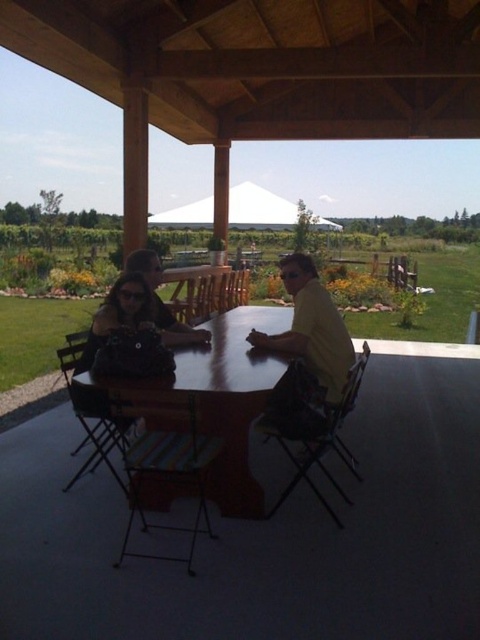
You are a photographer standing outside the wooden pavilion. You want to take a photo of the yellow matte shirt at center and the white fabric canopy at upper center so that both are clearly visible. Considering their heights, which object should be placed closer to the camera to ensure both are fully visible in the frame?

The yellow matte shirt at center has a lesser height compared to the white fabric canopy at upper center. To ensure both are fully visible in the frame, the yellow matte shirt at center should be placed closer to the camera since it is shorter, allowing its full height to be captured while the taller canopy can still be seen in the background.

From the picture: You are planning to set up a picnic under the pavilion. The wooden table at center is currently occupied by three people. Can you place a large picnic basket on the white fabric canopy at upper center instead?

The wooden table at center has a smaller size compared to white fabric canopy at upper center, so the picnic basket can be placed on the white fabric canopy at upper center as it is larger.

You are standing outside the wooden pavilion and want to place a new bench between the wooden table at center and the white fabric canopy at upper center. Based on their positions, which object should the bench be closer to?

The bench should be closer to the white fabric canopy at upper center because the wooden table at center is closer to the viewer, meaning the canopy is further away, so placing the bench between them would require it to be nearer to the canopy to maintain a balanced distance.